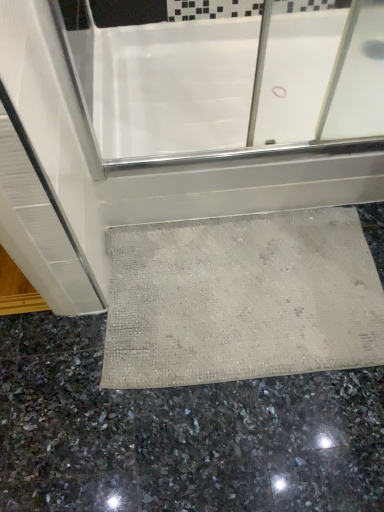
Question: Should I look upward or downward to see gray polished granite at lower center?

Choices:
 (A) down
 (B) up

Answer: (A)

Question: Is gray polished granite at lower center looking in the opposite direction of white glossy bathtub at center?

Choices:
 (A) no
 (B) yes

Answer: (A)

Question: Is gray polished granite at lower center positioned beyond the bounds of white glossy bathtub at center?

Choices:
 (A) no
 (B) yes

Answer: (B)

Question: From a real-world perspective, is gray polished granite at lower center on top of white glossy bathtub at center?

Choices:
 (A) yes
 (B) no

Answer: (B)

Question: Is white glossy bathtub at center a part of gray polished granite at lower center?

Choices:
 (A) no
 (B) yes

Answer: (A)

Question: From a real-world perspective, is gray polished granite at lower center below white glossy bathtub at center?

Choices:
 (A) no
 (B) yes

Answer: (B)

Question: From the image's perspective, does gray polished granite at lower center appear higher than white glossy bathtub at center?

Choices:
 (A) no
 (B) yes

Answer: (A)

Question: Are gray polished granite at lower center and beige textured bath mat at lower center located far from each other?

Choices:
 (A) yes
 (B) no

Answer: (B)

Question: Can you confirm if gray polished granite at lower center is thinner than beige textured bath mat at lower center?

Choices:
 (A) no
 (B) yes

Answer: (A)

Question: Can you confirm if gray polished granite at lower center is wider than beige textured bath mat at lower center?

Choices:
 (A) no
 (B) yes

Answer: (B)

Question: Is gray polished granite at lower center behind beige textured bath mat at lower center?

Choices:
 (A) yes
 (B) no

Answer: (B)

Question: From the image's perspective, would you say gray polished granite at lower center is positioned over beige textured bath mat at lower center?

Choices:
 (A) no
 (B) yes

Answer: (A)

Question: Could you tell me if gray polished granite at lower center is turned towards beige textured bath mat at lower center?

Choices:
 (A) yes
 (B) no

Answer: (A)

Question: Considering the relative sizes of white glossy bathtub at center and beige textured bath mat at lower center in the image provided, is white glossy bathtub at center shorter than beige textured bath mat at lower center?

Choices:
 (A) yes
 (B) no

Answer: (B)